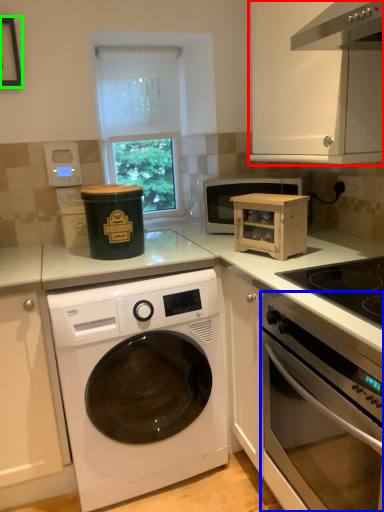
Question: Which object is the closest to the cabinetry (highlighted by a red box)? Choose among these: oven (highlighted by a blue box) or picture frame (highlighted by a green box).

Choices:
 (A) oven
 (B) picture frame

Answer: (A)